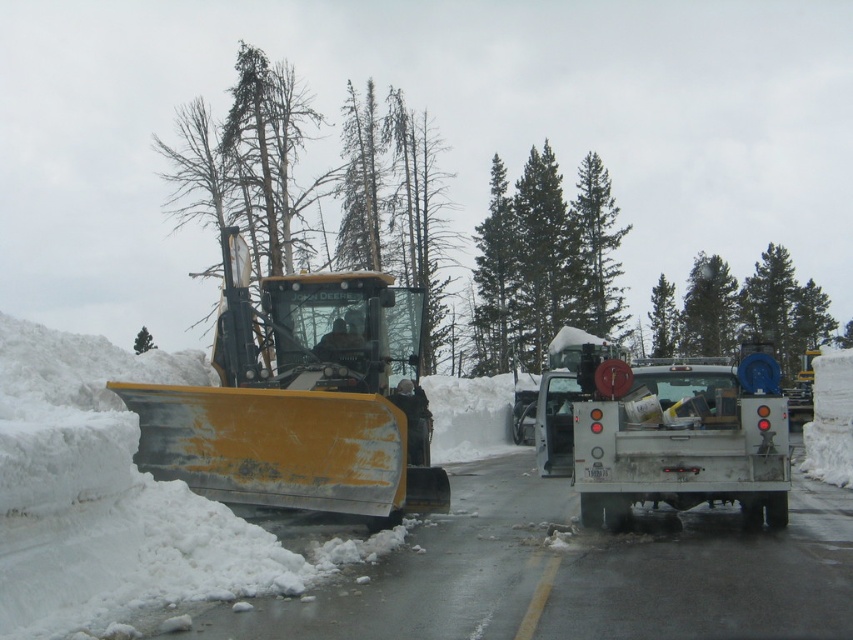
Question: Where is yellow metallic snowplow at left located in relation to green textured pine tree at center in the image?

Choices:
 (A) right
 (B) left

Answer: (B)

Question: Is yellow metallic snowplow at left above green coniferous trees at center?

Choices:
 (A) no
 (B) yes

Answer: (A)

Question: Which object is closer to the camera taking this photo?

Choices:
 (A) green matte tree at upper left
 (B) green textured tree at center

Answer: (B)

Question: Does white matte trailer truck at right come in front of green textured pine tree at center?

Choices:
 (A) no
 (B) yes

Answer: (B)

Question: Among these points, which one is farthest from the camera?

Choices:
 (A) (743, 308)
 (B) (309, 308)
 (C) (721, 336)

Answer: (A)

Question: Which point is closer to the camera?

Choices:
 (A) green matte tree at upper center
 (B) green textured tree at upper center
 (C) green coniferous trees at center

Answer: (B)